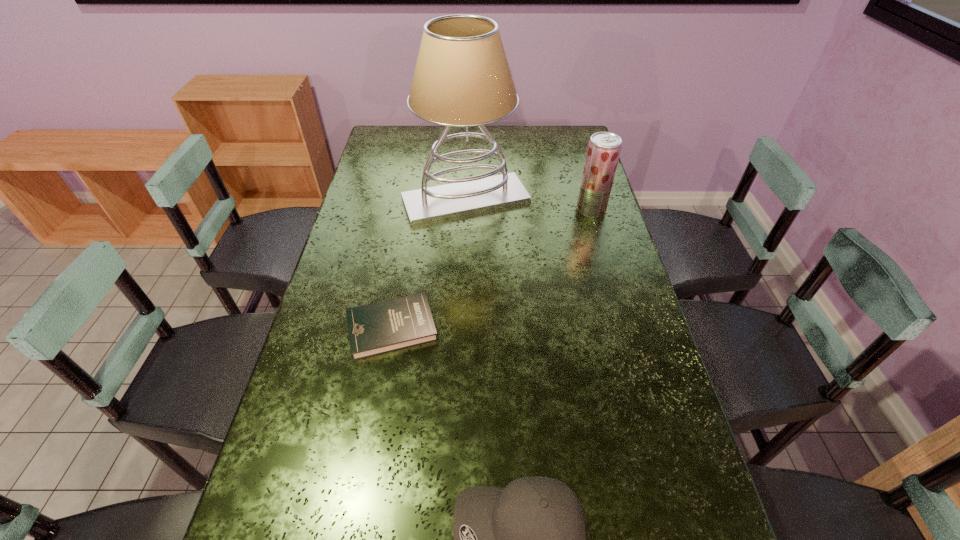
Where is `the tallest object`? the tallest object is located at coordinates (462, 78).

The height and width of the screenshot is (540, 960). I want to click on the rightmost object, so click(604, 148).

Find the location of `the second tallest object`. the second tallest object is located at coordinates (604, 148).

I want to click on the shortest object, so coord(389,325).

At what (x,y) coordinates should I click in order to perform the action: click on book. Please return your answer as a coordinate pair (x, y). Image resolution: width=960 pixels, height=540 pixels. Looking at the image, I should click on (389, 325).

Locate an element on the screen. The image size is (960, 540). free space located 0.150m on the front of the tallest object is located at coordinates (464, 261).

Find the location of `vacant space located on the front of the third shortest object`. vacant space located on the front of the third shortest object is located at coordinates (611, 278).

This screenshot has height=540, width=960. In order to click on blank space located 0.060m on the front of the shortest object in this screenshot , I will do `click(382, 381)`.

Find the location of a particular element. The width and height of the screenshot is (960, 540). object that is at the left edge is located at coordinates (389, 325).

Where is `object that is at the right edge`? The height and width of the screenshot is (540, 960). object that is at the right edge is located at coordinates (604, 148).